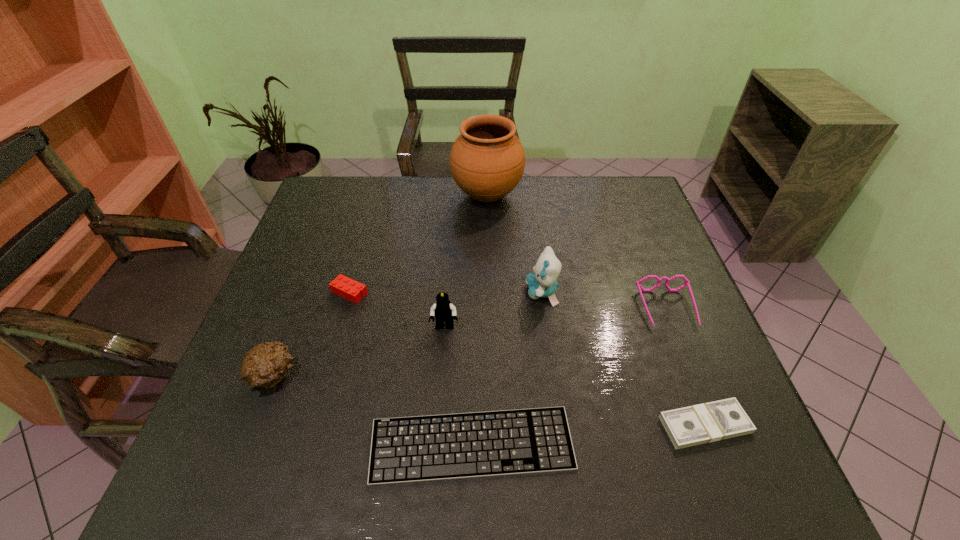
Identify the location of free point between the dollar and the shorter Lego. (527, 359).

Image resolution: width=960 pixels, height=540 pixels. Identify the location of vacant area between the shortest object and the seventh tallest object. (588, 435).

Locate an element on the screen. free space between the kitten and the sixth farthest object is located at coordinates (408, 334).

Image resolution: width=960 pixels, height=540 pixels. Find the location of `vacant space that is in between the fifth tallest object and the third nearest object`. vacant space that is in between the fifth tallest object and the third nearest object is located at coordinates (470, 342).

Where is `empty space between the leftmost object and the seventh tallest object`? This screenshot has width=960, height=540. empty space between the leftmost object and the seventh tallest object is located at coordinates (490, 400).

You are a GUI agent. You are given a task and a screenshot of the screen. Output one action in this format:
    pyautogui.click(x=<x>, y=<y>)
    Task: Click on the empty space between the fourth shortest object and the third tallest object
    The width and height of the screenshot is (960, 540).
    Given the screenshot: What is the action you would take?
    pyautogui.click(x=556, y=318)

Identify the location of object that is the seventh closest one to the spectacles. (264, 366).

In order to click on the fifth closest object to the seventh shortest object in this screenshot , I will do `click(718, 420)`.